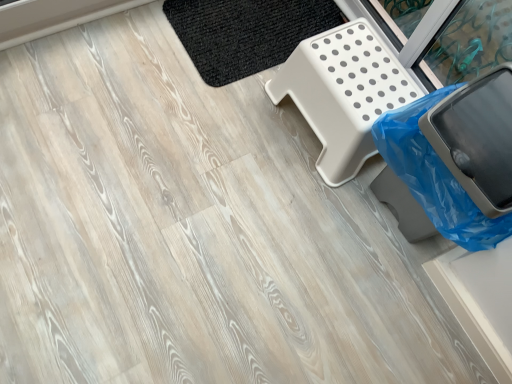
Locate an element on the screen. The height and width of the screenshot is (384, 512). free space on the front side of black woven mat at upper center is located at coordinates (207, 119).